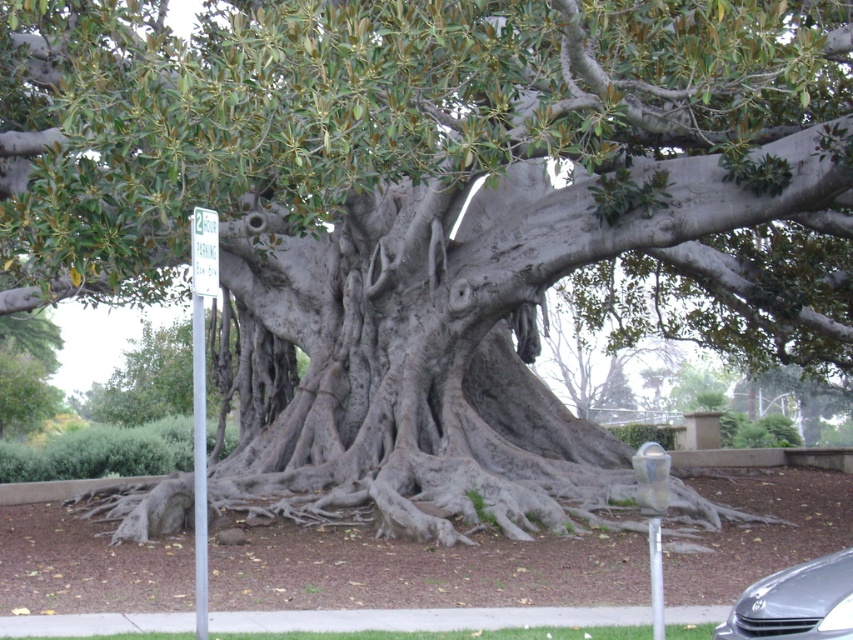
Question: Can you confirm if metallic gray car at lower right is bigger than white plastic sign at left?

Choices:
 (A) no
 (B) yes

Answer: (A)

Question: Which point appears closest to the camera in this image?

Choices:
 (A) (201, 272)
 (B) (206, 268)

Answer: (A)

Question: Which point is farther to the camera?

Choices:
 (A) (195, 452)
 (B) (750, 632)
 (C) (194, 209)

Answer: (C)

Question: Which point is farther to the camera?

Choices:
 (A) (198, 528)
 (B) (209, 225)

Answer: (B)

Question: Can you confirm if metallic gray car at lower right is positioned to the left of white plastic parking sign at upper left?

Choices:
 (A) no
 (B) yes

Answer: (A)

Question: Is metallic gray car at lower right above white plastic sign at left?

Choices:
 (A) no
 (B) yes

Answer: (A)